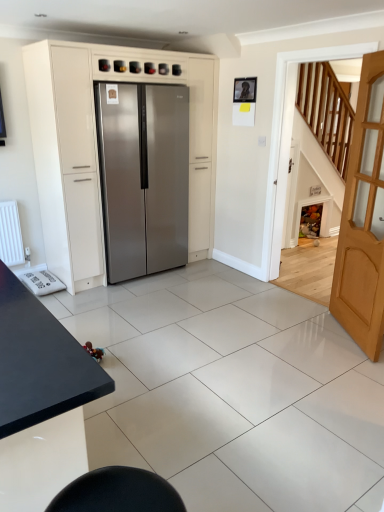
Describe the element at coordinates (363, 219) in the screenshot. I see `light brown wooden door at right` at that location.

You are a GUI agent. You are given a task and a screenshot of the screen. Output one action in this format:
    pyautogui.click(x=<x>, y=<y>)
    Task: Click on the stainless steel refrigerator at center
    This screenshot has width=384, height=512.
    Given the screenshot: What is the action you would take?
    pyautogui.click(x=143, y=177)

Describe the element at coordinates (95, 139) in the screenshot. Image resolution: width=384 pixels, height=512 pixels. I see `satin silver refrigerator at center` at that location.

At what (x,y) coordinates should I click in order to perform the action: click on satin silver refrigerator at center. Please return your answer as a coordinate pair (x, y). This screenshot has width=384, height=512. Looking at the image, I should click on (95, 139).

Identify the location of light brown wooden door at right. (363, 219).

What are the coordinates of `cabinetry positioned vertically above the black matte table at lower left (from a real-world perspective)` in the screenshot? It's located at (95, 139).

From a real-world perspective, is satin silver refrigerator at center below black matte table at lower left?

No.

Who is shorter, satin silver refrigerator at center or black matte table at lower left?

Standing shorter between the two is black matte table at lower left.

Which is less distant, (208, 93) or (68, 413)?

The point (68, 413) is in front.

How different are the orientations of black matte table at lower left and light brown wooden door at right in degrees?

They differ by 121 degrees in their facing directions.

Between point (33, 428) and point (379, 74), which one is positioned behind?

The point (379, 74) is farther.

Can you confirm if black matte table at lower left is shorter than light brown wooden door at right?

Yes.

Is black matte table at lower left directly adjacent to light brown wooden door at right?

No, black matte table at lower left is not making contact with light brown wooden door at right.

Is stainless steel refrigerator at center positioned far away from satin silver refrigerator at center?

They are positioned close to each other.

The width and height of the screenshot is (384, 512). What are the coordinates of `cabinetry above the stainless steel refrigerator at center (from the image's perspective)` in the screenshot? It's located at [x=95, y=139].

Would you say stainless steel refrigerator at center contains satin silver refrigerator at center?

Indeed, satin silver refrigerator at center is located within stainless steel refrigerator at center.

Is stainless steel refrigerator at center oriented towards satin silver refrigerator at center?

Yes, stainless steel refrigerator at center is aimed at satin silver refrigerator at center.

Is satin silver refrigerator at center oriented away from light brown wooden door at right?

No.

In the image, there is a satin silver refrigerator at center. In order to click on door below it (from a real-world perspective) in this screenshot , I will do `click(363, 219)`.

Does point (34, 55) come closer to viewer compared to point (362, 192)?

No, (34, 55) is behind (362, 192).

Measure the distance between satin silver refrigerator at center and light brown wooden door at right.

1.99 meters.

The height and width of the screenshot is (512, 384). What are the coordinates of `refrigerator on the left side of light brown wooden door at right` in the screenshot? It's located at (143, 177).

Considering the positions of objects stainless steel refrigerator at center and light brown wooden door at right in the image provided, who is more to the right, stainless steel refrigerator at center or light brown wooden door at right?

Positioned to the right is light brown wooden door at right.

Which point is more distant from viewer, (118, 130) or (366, 131)?

Point (118, 130)

Is stainless steel refrigerator at center situated inside light brown wooden door at right or outside?

stainless steel refrigerator at center lies outside light brown wooden door at right.

The image size is (384, 512). I want to click on cabinetry that appears in front of the stainless steel refrigerator at center, so click(95, 139).

Is satin silver refrigerator at center looking in the opposite direction of stainless steel refrigerator at center?

Yes.

What's the angular difference between satin silver refrigerator at center and stainless steel refrigerator at center's facing directions?

The facing directions of satin silver refrigerator at center and stainless steel refrigerator at center are 2.21 degrees apart.

Is satin silver refrigerator at center further to the viewer compared to stainless steel refrigerator at center?

No, satin silver refrigerator at center is closer to the viewer.

At what (x,y) coordinates should I click in order to perform the action: click on cabinetry above the light brown wooden door at right (from a real-world perspective). Please return your answer as a coordinate pair (x, y). Looking at the image, I should click on (95, 139).

Which is closer, [379,218] or [65,153]?

Point [379,218] appears to be closer to the viewer than point [65,153].

Consider the image. Which object is closer to the camera, light brown wooden door at right or satin silver refrigerator at center?

light brown wooden door at right is in front.

Image resolution: width=384 pixels, height=512 pixels. Identify the location of cabinetry above the black matte table at lower left (from the image's perspective). (95, 139).

Locate an element on the screen. The height and width of the screenshot is (512, 384). table in front of the light brown wooden door at right is located at coordinates (40, 400).

Which object lies nearer to the anchor point stainless steel refrigerator at center, black matte table at lower left or satin silver refrigerator at center?

The object closer to stainless steel refrigerator at center is satin silver refrigerator at center.

Based on the photo, considering their positions, is black matte table at lower left positioned closer to light brown wooden door at right than satin silver refrigerator at center?

satin silver refrigerator at center is positioned closer to the anchor light brown wooden door at right.

When comparing their distances from stainless steel refrigerator at center, does light brown wooden door at right or black matte table at lower left seem further?

The object further to stainless steel refrigerator at center is black matte table at lower left.

In the scene shown: Which object lies nearer to the anchor point light brown wooden door at right, satin silver refrigerator at center or black matte table at lower left?

Among the two, satin silver refrigerator at center is located nearer to light brown wooden door at right.

Based on their spatial positions, is stainless steel refrigerator at center or satin silver refrigerator at center closer to black matte table at lower left?

stainless steel refrigerator at center lies closer to black matte table at lower left than the other object.

Which object lies nearer to the anchor point stainless steel refrigerator at center, light brown wooden door at right or satin silver refrigerator at center?

satin silver refrigerator at center is positioned closer to the anchor stainless steel refrigerator at center.

Which object lies nearer to the anchor point satin silver refrigerator at center, light brown wooden door at right or stainless steel refrigerator at center?

Among the two, stainless steel refrigerator at center is located nearer to satin silver refrigerator at center.

Estimate the real-world distances between objects in this image. Which object is closer to black matte table at lower left, satin silver refrigerator at center or light brown wooden door at right?

light brown wooden door at right lies closer to black matte table at lower left than the other object.

Where is `door between black matte table at lower left and stainless steel refrigerator at center from front to back`? The height and width of the screenshot is (512, 384). door between black matte table at lower left and stainless steel refrigerator at center from front to back is located at coordinates (363, 219).

This screenshot has height=512, width=384. I want to click on refrigerator located between satin silver refrigerator at center and light brown wooden door at right in the left-right direction, so pyautogui.click(x=143, y=177).

The image size is (384, 512). What are the coordinates of `cabinetry located between black matte table at lower left and stainless steel refrigerator at center in the depth direction` in the screenshot? It's located at (95, 139).

Where is `cabinetry situated between black matte table at lower left and light brown wooden door at right from left to right`? This screenshot has width=384, height=512. cabinetry situated between black matte table at lower left and light brown wooden door at right from left to right is located at coordinates (95, 139).